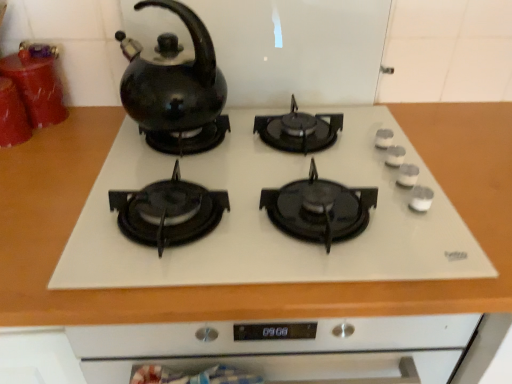
Question: Could you tell me if black glossy kettle at upper left is facing matte red canister at left, the second kitchen appliance viewed from the back?

Choices:
 (A) yes
 (B) no

Answer: (B)

Question: Can you confirm if black glossy kettle at upper left is positioned to the left of matte red canister at left, the second kitchen appliance viewed from the back?

Choices:
 (A) yes
 (B) no

Answer: (B)

Question: Considering the relative positions of black glossy kettle at upper left and matte red canister at left, which appears as the 1th kitchen appliance when viewed from the front, in the image provided, is black glossy kettle at upper left in front of matte red canister at left, which appears as the 1th kitchen appliance when viewed from the front,?

Choices:
 (A) yes
 (B) no

Answer: (A)

Question: Can you confirm if black glossy kettle at upper left is bigger than matte red canister at left, the second kitchen appliance viewed from the back?

Choices:
 (A) yes
 (B) no

Answer: (A)

Question: Would you say black glossy kettle at upper left is a long distance from matte red canister at left, the second kitchen appliance viewed from the back?

Choices:
 (A) no
 (B) yes

Answer: (A)

Question: Does black glossy kettle at upper left have a smaller size compared to matte red canister at left, the second kitchen appliance viewed from the back?

Choices:
 (A) no
 (B) yes

Answer: (A)

Question: From a real-world perspective, is matte red canister at left, the second kitchen appliance viewed from the back, under shiny red glass cups at left, which is counted as the 1th kitchen appliance, starting from the back?

Choices:
 (A) no
 (B) yes

Answer: (B)

Question: Is the position of matte red canister at left, which appears as the 1th kitchen appliance when viewed from the front, more distant than that of shiny red glass cups at left, which is counted as the 1th kitchen appliance, starting from the back?

Choices:
 (A) no
 (B) yes

Answer: (A)

Question: Would you say matte red canister at left, which appears as the 1th kitchen appliance when viewed from the front, is outside shiny red glass cups at left, the second kitchen appliance positioned from the front?

Choices:
 (A) yes
 (B) no

Answer: (B)

Question: Is matte red canister at left, the second kitchen appliance viewed from the back, to the left of shiny red glass cups at left, which is counted as the 1th kitchen appliance, starting from the back, from the viewer's perspective?

Choices:
 (A) yes
 (B) no

Answer: (A)

Question: From the image's perspective, is matte red canister at left, which appears as the 1th kitchen appliance when viewed from the front, on top of shiny red glass cups at left, which is counted as the 1th kitchen appliance, starting from the back?

Choices:
 (A) yes
 (B) no

Answer: (B)

Question: Is matte red canister at left, the second kitchen appliance viewed from the back, looking in the opposite direction of shiny red glass cups at left, the second kitchen appliance positioned from the front?

Choices:
 (A) yes
 (B) no

Answer: (A)

Question: Could you tell me if black glossy kettle at upper left is facing shiny red glass cups at left, which is counted as the 1th kitchen appliance, starting from the back?

Choices:
 (A) yes
 (B) no

Answer: (B)